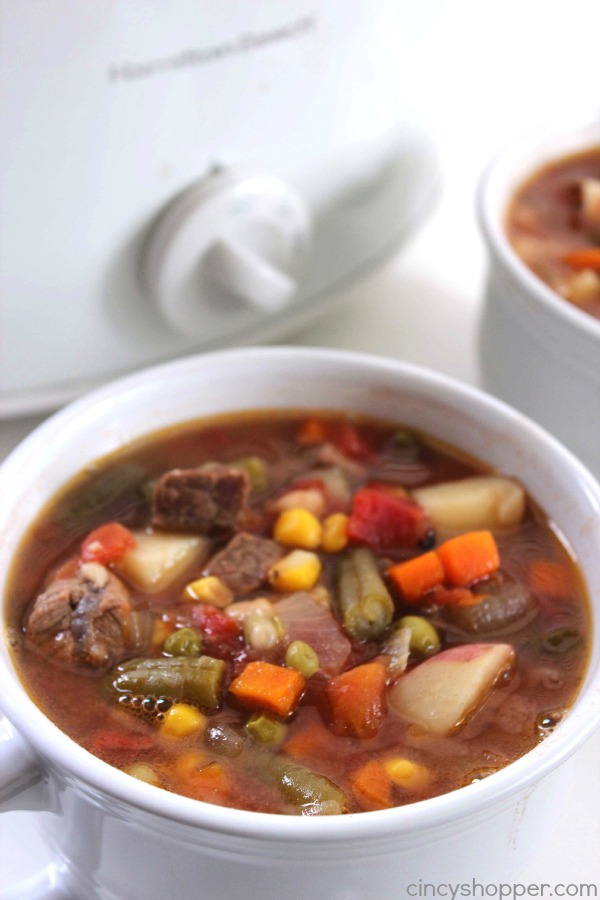
Image resolution: width=600 pixels, height=900 pixels. Identify the location of brightly lit space. (480, 91).